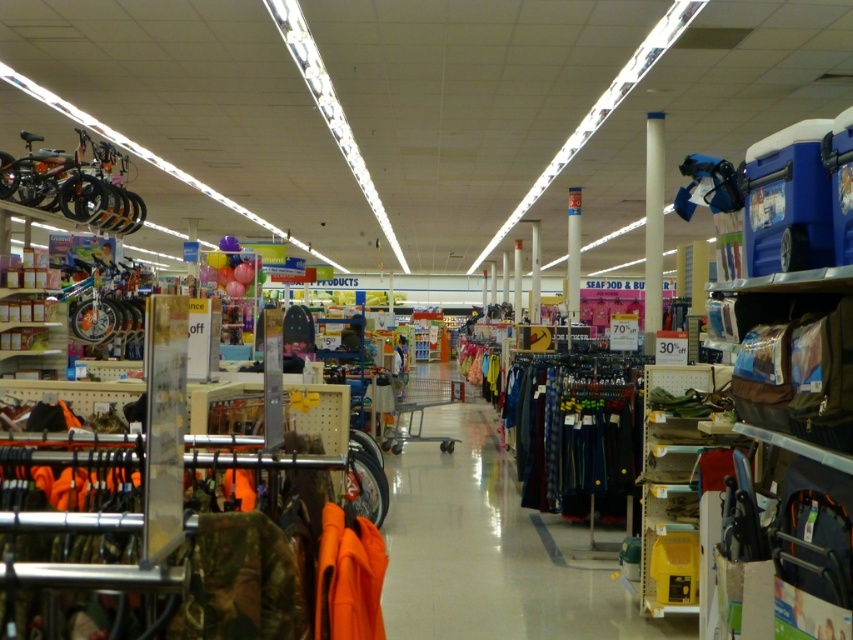
Question: In this image, where is yellow plastic bin at lower right located relative to white matte pillar at center?

Choices:
 (A) left
 (B) right

Answer: (A)

Question: Does yellow plastic bin at lower right come behind white matte pillar at center?

Choices:
 (A) yes
 (B) no

Answer: (B)

Question: Which point appears closest to the camera in this image?

Choices:
 (A) (657, 292)
 (B) (688, 580)

Answer: (B)

Question: Can you confirm if yellow plastic bin at lower right is thinner than white matte pillar at center?

Choices:
 (A) yes
 (B) no

Answer: (B)